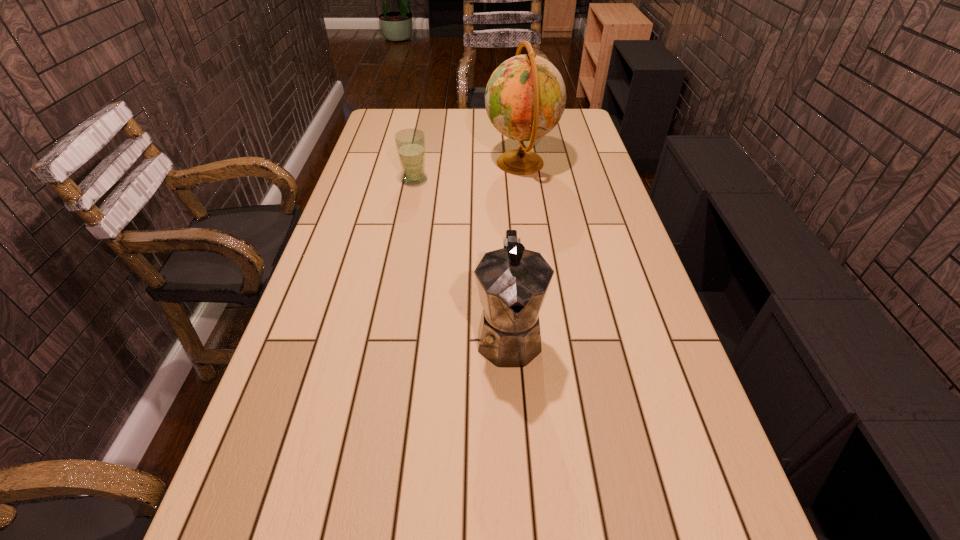
Find the location of a particular element. Image resolution: width=960 pixels, height=540 pixels. free point at the right edge is located at coordinates (576, 181).

In the image, there is a desktop. At what (x,y) coordinates should I click in order to perform the action: click on vacant region at the far left corner. Please return your answer as a coordinate pair (x, y). The width and height of the screenshot is (960, 540). Looking at the image, I should click on (401, 126).

In order to click on vacant area at the far right corner in this screenshot , I will do `click(577, 112)`.

Find the location of a particular element. This screenshot has width=960, height=540. vacant area between the glass and the second shortest object is located at coordinates (462, 258).

Where is `vacant space that is in between the globe and the shortest object`? vacant space that is in between the globe and the shortest object is located at coordinates (468, 172).

At what (x,y) coordinates should I click in order to perform the action: click on object that ranks as the closest to the second shortest object. Please return your answer as a coordinate pair (x, y). This screenshot has height=540, width=960. Looking at the image, I should click on click(x=525, y=97).

I want to click on object that is the second nearest to the shortest object, so click(512, 282).